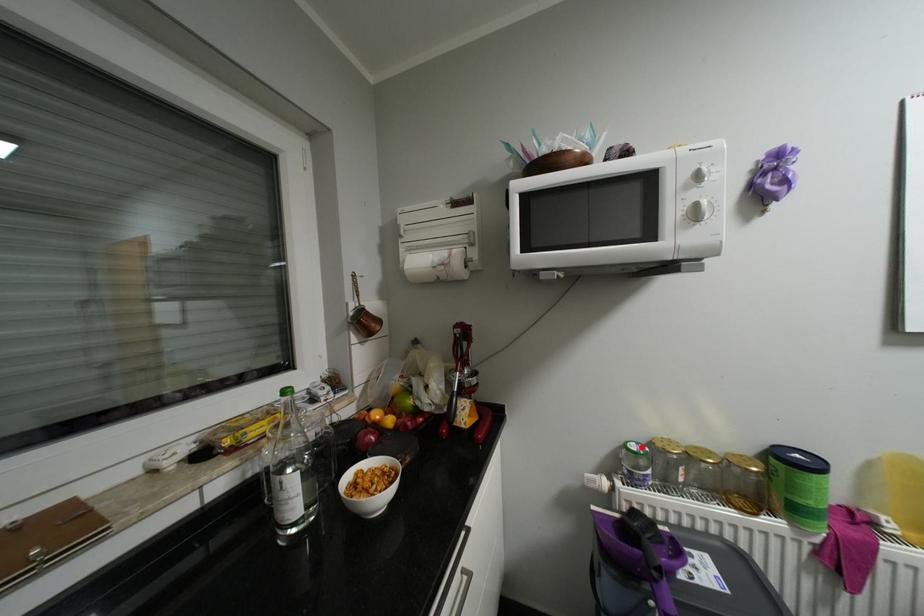
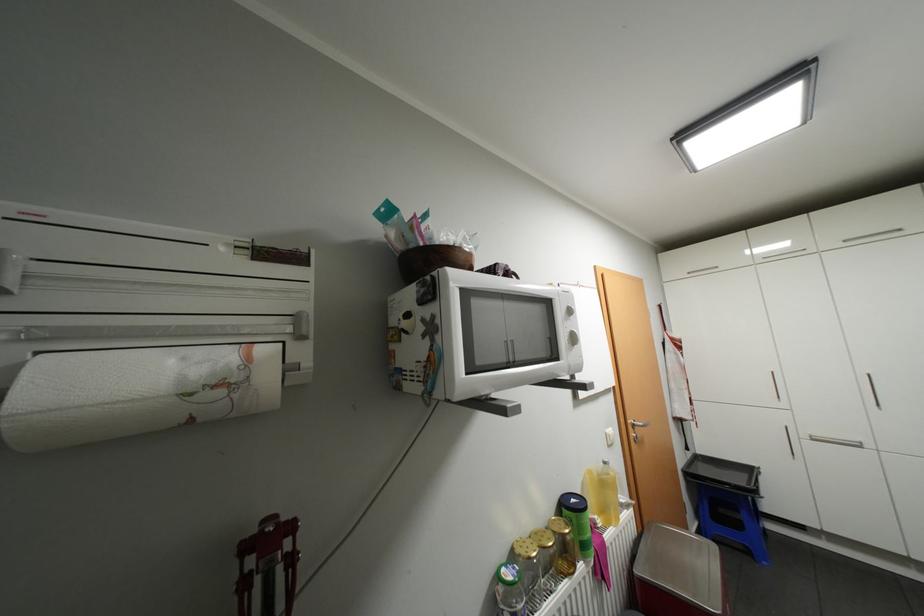
Where in the second image is the point corresponding to the highlighted location from the first image?

(518, 576)